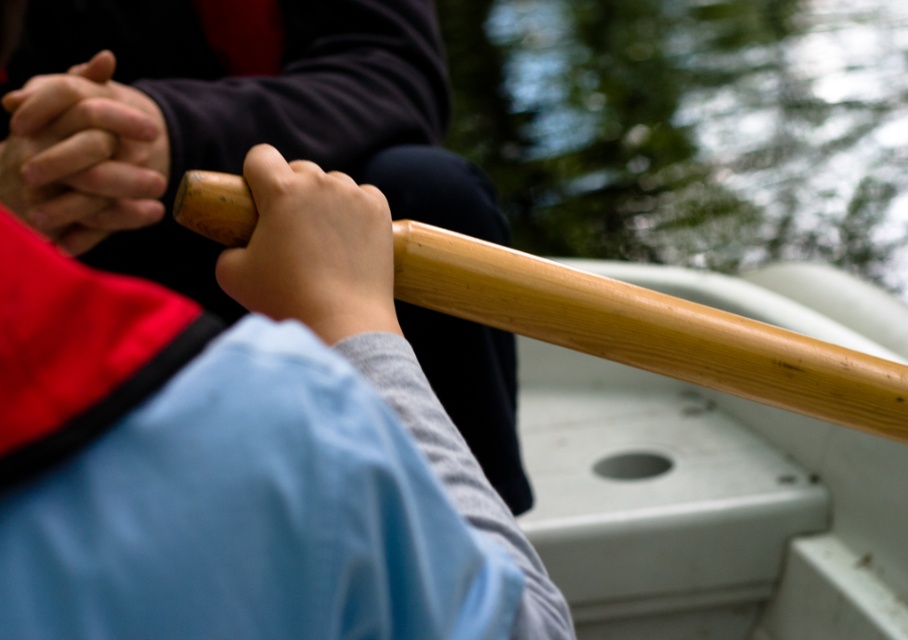
From the picture: You are holding the natural wood paddle at center and the wooden paddle handle at center. Which one is positioned to the right?

The natural wood paddle at center is positioned to the right of the wooden paddle handle at center.

You are a beginner learning to row a boat. You see your hands and the wooden paddle handle in the scene. According to the image, where are your matte black hands at center relative to the wooden paddle handle at center?

The matte black hands at center are above the wooden paddle handle at center.

You are in a boat and need to reach a floating object located at the coordinates point (x=240, y=371). Which object should you use to reach it?

The point (x=240, y=371) corresponds to the wooden paddle at upper center, so you should use the wooden paddle at upper center to reach it.